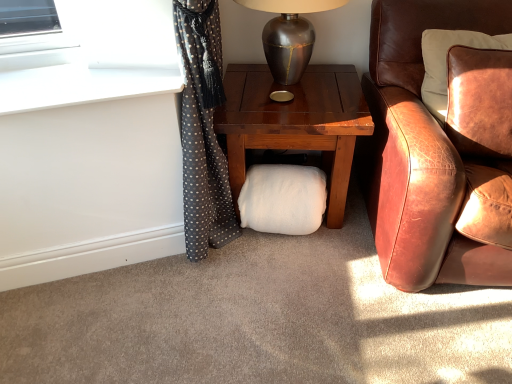
I want to click on vacant point to the right of white fluffy pillow at center, so click(x=349, y=240).